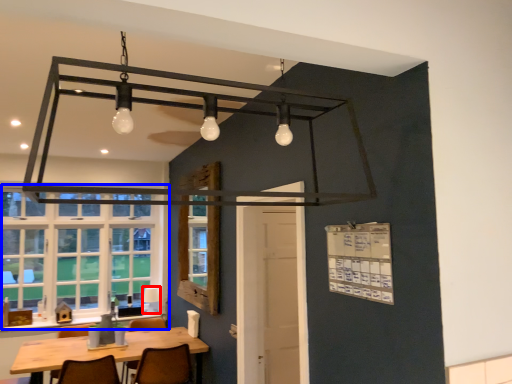
Question: Which object appears farthest to the camera in this image, lamp (highlighted by a red box) or window (highlighted by a blue box)?

Choices:
 (A) lamp
 (B) window

Answer: (A)